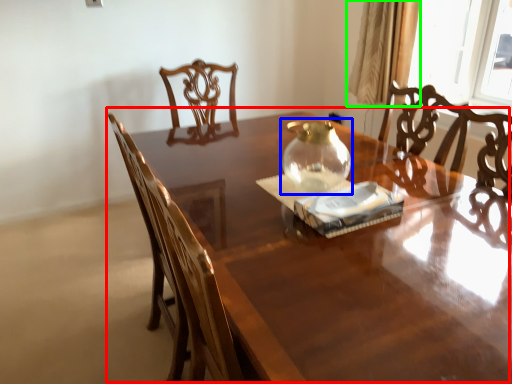
Question: Which object is the closest to the table (highlighted by a red box)? Choose among these: glass vase (highlighted by a blue box) or curtain (highlighted by a green box).

Choices:
 (A) glass vase
 (B) curtain

Answer: (A)